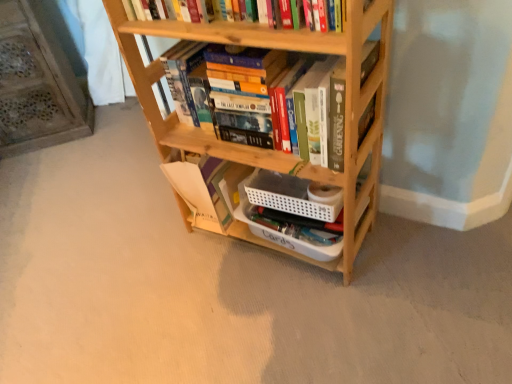
Question: Can you confirm if wooden bookshelf at left is positioned to the right of wooden bookshelf at center?

Choices:
 (A) yes
 (B) no

Answer: (B)

Question: Are wooden bookshelf at left and wooden bookshelf at center located far from each other?

Choices:
 (A) no
 (B) yes

Answer: (B)

Question: Is wooden bookshelf at left behind wooden bookshelf at center?

Choices:
 (A) no
 (B) yes

Answer: (B)

Question: From the image's perspective, would you say wooden bookshelf at left is positioned over wooden bookshelf at center?

Choices:
 (A) no
 (B) yes

Answer: (B)

Question: Does wooden bookshelf at left have a smaller size compared to wooden bookshelf at center?

Choices:
 (A) no
 (B) yes

Answer: (A)

Question: Considering the relative positions of wooden bookshelf at left and wooden bookshelf at center in the image provided, is wooden bookshelf at left to the left or to the right of wooden bookshelf at center?

Choices:
 (A) left
 (B) right

Answer: (A)

Question: Is wooden bookshelf at left situated inside wooden bookshelf at center or outside?

Choices:
 (A) outside
 (B) inside

Answer: (A)

Question: Based on their sizes in the image, would you say wooden bookshelf at left is bigger or smaller than wooden bookshelf at center?

Choices:
 (A) big
 (B) small

Answer: (A)

Question: From a real-world perspective, is wooden bookshelf at left above or below wooden bookshelf at center?

Choices:
 (A) above
 (B) below

Answer: (B)

Question: Considering the positions of wooden bookshelf at center and natural wood bookcase at center in the image, is wooden bookshelf at center taller or shorter than natural wood bookcase at center?

Choices:
 (A) tall
 (B) short

Answer: (B)

Question: From a real-world perspective, relative to natural wood bookcase at center, is wooden bookshelf at center vertically above or below?

Choices:
 (A) above
 (B) below

Answer: (A)

Question: Considering the positions of wooden bookshelf at center and natural wood bookcase at center in the image, is wooden bookshelf at center wider or thinner than natural wood bookcase at center?

Choices:
 (A) thin
 (B) wide

Answer: (A)

Question: In terms of size, does wooden bookshelf at center appear bigger or smaller than natural wood bookcase at center?

Choices:
 (A) small
 (B) big

Answer: (A)

Question: Visually, is wooden bookshelf at center positioned to the left or to the right of wooden bookshelf at left?

Choices:
 (A) left
 (B) right

Answer: (B)

Question: From a real-world perspective, relative to wooden bookshelf at left, is wooden bookshelf at center vertically above or below?

Choices:
 (A) below
 (B) above

Answer: (B)